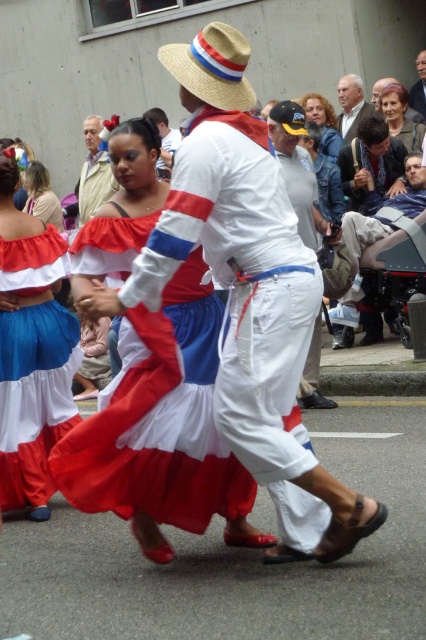
In the scene shown: You are a photographer standing in front of the dancers. You want to take a photo focusing on the matte white blouse at center and the smooth beige hair at upper center. Which object will appear closer to the camera in the photo?

The matte white blouse at center will appear closer to the camera in the photo because it is further to the viewer than the smooth beige hair at upper center.

You are a photographer trying to capture a photo of the dancers. You notice two items in the background that might distract the viewers. These items are the light beige fabric jacket at upper left and the white cotton hat at upper center. Based on their positions, which one is located more to the left?

The light beige fabric jacket at upper left is more to the left than the white cotton hat at upper center because it is positioned on the left side of the white cotton hat at upper center.